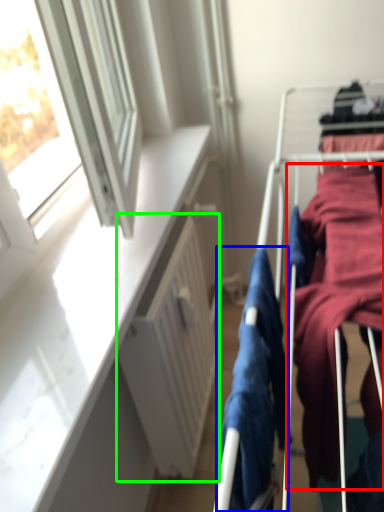
Question: Which object is positioned farthest from clothing (highlighted by a red box)? Select from clothing (highlighted by a blue box) and radiator (highlighted by a green box).

Choices:
 (A) clothing
 (B) radiator

Answer: (B)